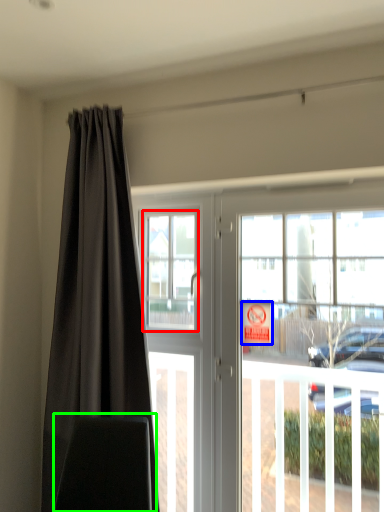
Question: Which is nearer to the window screen (highlighted by a red box)? parking sign (highlighted by a blue box) or swivel chair (highlighted by a green box).

Choices:
 (A) parking sign
 (B) swivel chair

Answer: (A)